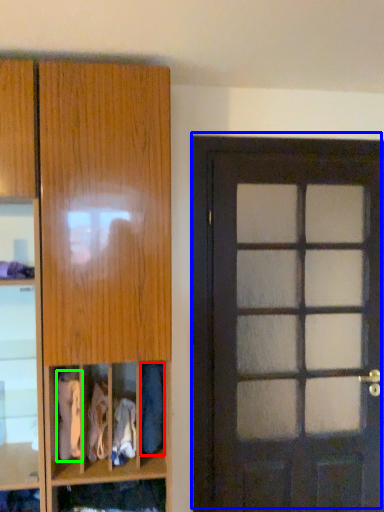
Question: Which object is positioned farthest from clothing (highlighted by a red box)? Select from door (highlighted by a blue box) and clothing (highlighted by a green box).

Choices:
 (A) door
 (B) clothing

Answer: (A)